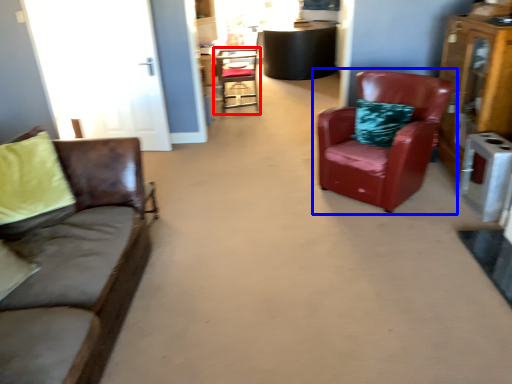
Question: Which point is closer to the camera, chair (highlighted by a red box) or chair (highlighted by a blue box)?

Choices:
 (A) chair
 (B) chair

Answer: (B)